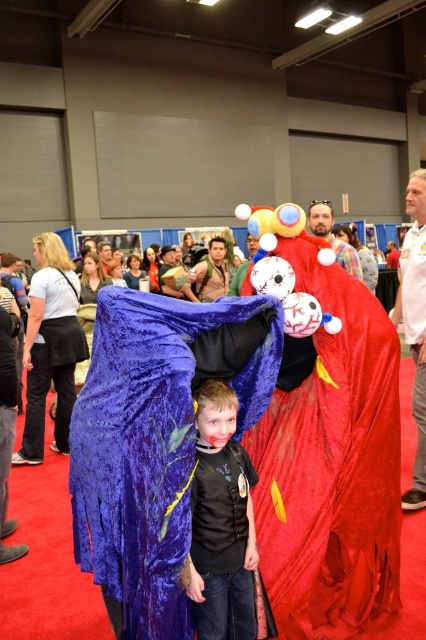
Can you confirm if black matte vest at center is positioned to the right of velvet red cape at center?

Incorrect, black matte vest at center is not on the right side of velvet red cape at center.

Describe the element at coordinates (221, 522) in the screenshot. I see `black matte vest at center` at that location.

Locate an element on the screen. This screenshot has height=640, width=426. black matte vest at center is located at coordinates (221, 522).

Locate an element on the screen. black matte vest at center is located at coordinates (221, 522).

Who is lower down, black matte vest at center or smooth white shirt at right?

black matte vest at center is lower down.

The image size is (426, 640). Identify the location of black matte vest at center. (221, 522).

Which is above, smooth white shirt at right or velvet red cape at center?

Positioned higher is velvet red cape at center.

Between point (420, 326) and point (327, 221), which one is positioned behind?

Point (327, 221)

Does point (417, 173) lie in front of point (313, 232)?

Yes, point (417, 173) is in front of point (313, 232).

At what (x,y) coordinates should I click in order to perform the action: click on smooth white shirt at right. Please return your answer as a coordinate pair (x, y). The height and width of the screenshot is (640, 426). Looking at the image, I should click on (414, 324).